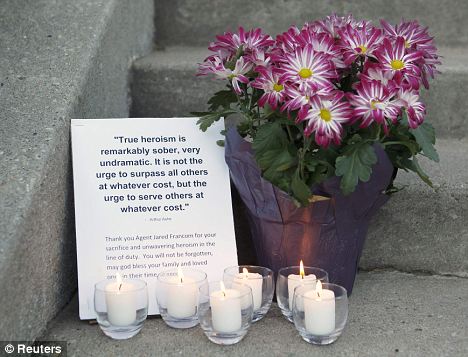
The image size is (468, 357). Identify the location of glass candle holders. (107, 309), (165, 302), (212, 324), (264, 292), (283, 295), (307, 328).